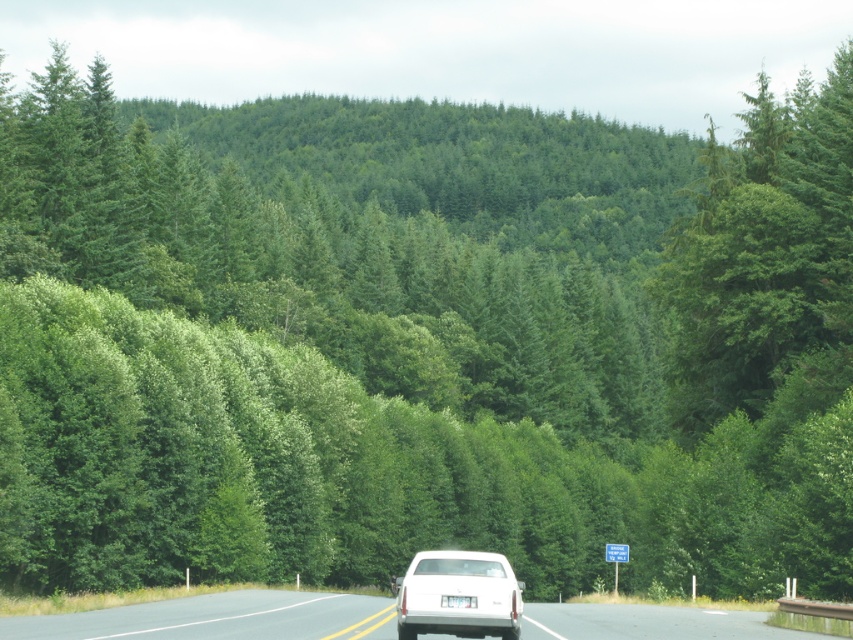
You are driving a white glossy car at center and want to overtake a slower vehicle ahead. You see a white glossy truck at center coming from the opposite direction. Considering the road is two lanes with a double yellow line, can you safely pass the vehicle ahead before the truck arrives?

The white glossy truck at center is wider than the white glossy car at center. Since the road has a double yellow line indicating no passing zones, it is not safe to overtake the vehicle ahead as passing is prohibited in this area.

From the picture: You are driving a car that is 4.5 meters long and want to overtake the vehicle ahead on this two lane road. The road has a double yellow line, which means no passing is allowed. However, you notice a gap in the oncoming traffic. Can you safely pass the white glossy truck at center using the space between the white glossy car at center and the oncoming traffic?

The white glossy truck at center is 10.55 meters away from the white glossy car at center. Since the road has a double yellow line, passing is prohibited regardless of the distance. You should not attempt to overtake the white glossy truck at center in this situation.